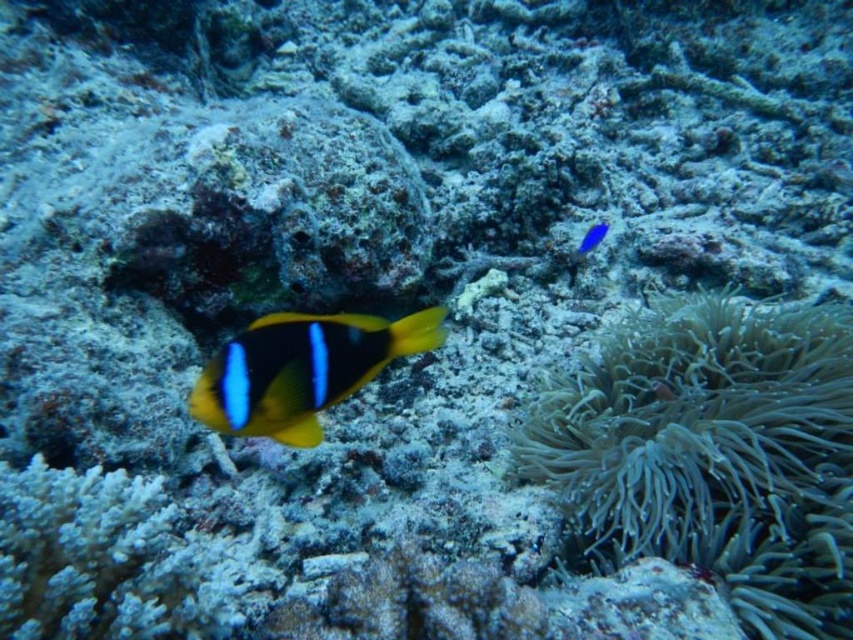
You are a marine biologist observing the underwater scene. You notice the yellow matte clownfish at center and the glossy blue fish at upper right. Which fish has a wider body according to the description?

The yellow matte clownfish at center might be wider than glossy blue fish at upper right according to the description.

You are a marine biologist studying underwater life. You notice a yellow fish with blue stripes near a coral formation. There is also a point marked at coordinates (712, 452). What object does this point correspond to?

The point at coordinates (712, 452) corresponds to the soft gray coral at lower right.